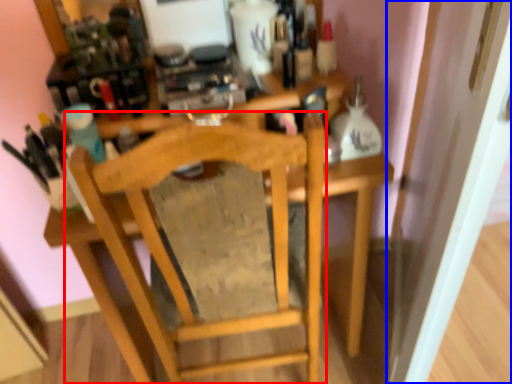
Question: Which of the following is the closest to the observer, chair (highlighted by a red box) or door (highlighted by a blue box)?

Choices:
 (A) chair
 (B) door

Answer: (B)